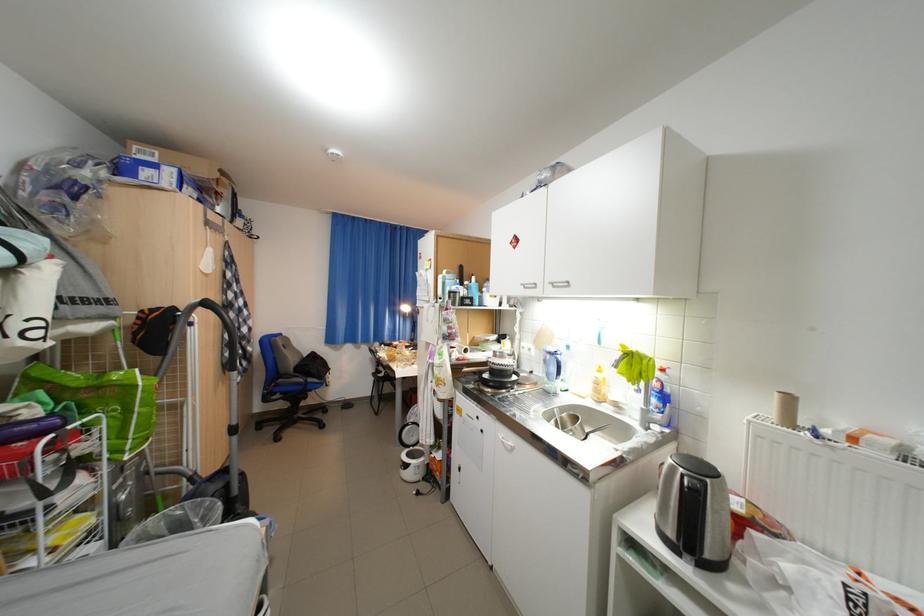
Identify the location of metal cup. The height and width of the screenshot is (616, 924). (694, 512).